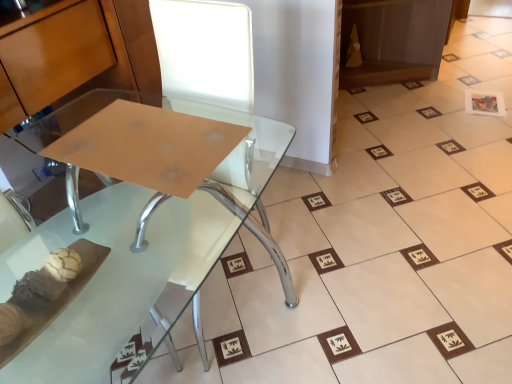
You are a GUI agent. You are given a task and a screenshot of the screen. Output one action in this format:
    pyautogui.click(x=<x>, y=<y>)
    Task: Click on the vacant area that is in front of white paper at upper right
    The height and width of the screenshot is (384, 512).
    Given the screenshot: What is the action you would take?
    pyautogui.click(x=490, y=125)